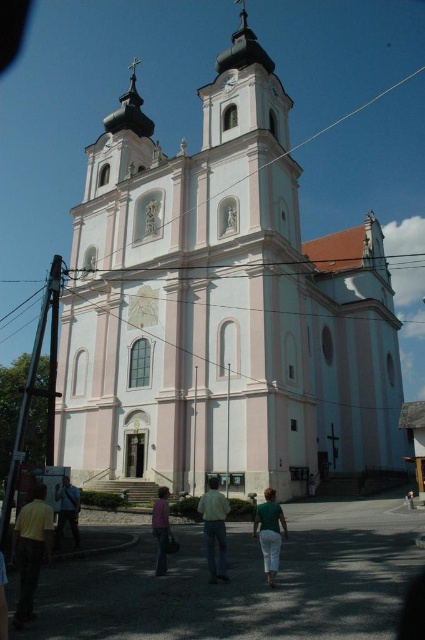
You are a photographer standing in front of the church and want to take a photo that includes both the dark brown leather pants at lower left and the green cotton pants at lower center. Which pair of pants should you focus on first to ensure they are both in the frame?

The dark brown leather pants at lower left is taller than the green cotton pants at lower center, so you should focus on the dark brown leather pants at lower left first to ensure both are in the frame.

You are standing in front of the church and see two people wearing green cotton pants at lower center and light blue jeans at lower left. Which person is standing closer to the church entrance?

The green cotton pants at lower center is positioned over light blue jeans at lower left, meaning they are closer to the church entrance.